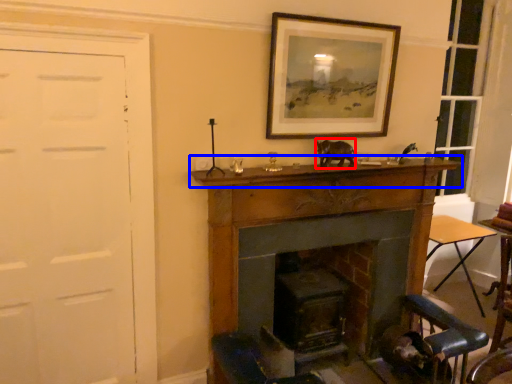
Question: Which object is further to the camera taking this photo, animal (highlighted by a red box) or mantle (highlighted by a blue box)?

Choices:
 (A) animal
 (B) mantle

Answer: (A)